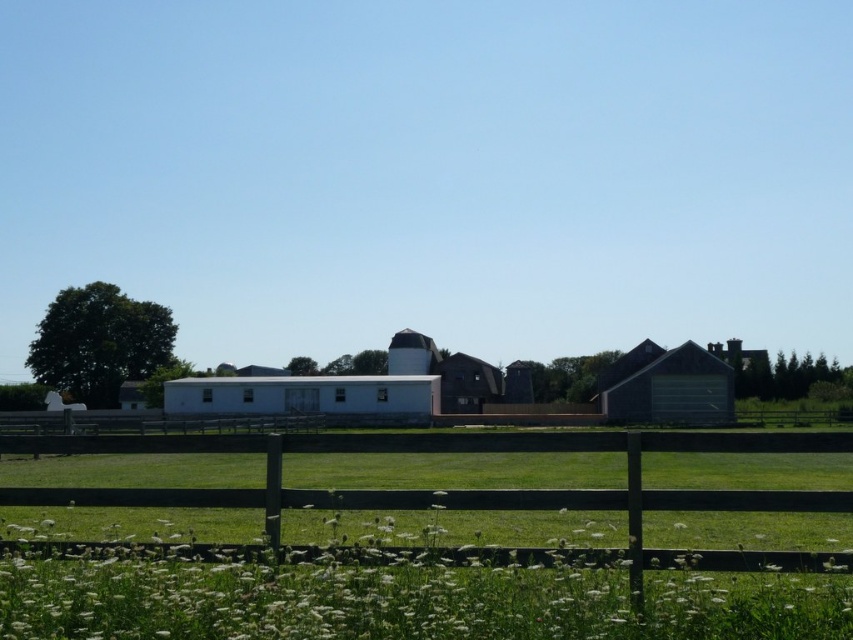
Can you confirm if white matte barn at center is smaller than green corrugated metal barn at right?

No.

Can you confirm if white matte barn at center is positioned to the right of green corrugated metal barn at right?

Incorrect, white matte barn at center is not on the right side of green corrugated metal barn at right.

Locate an element on the screen. The height and width of the screenshot is (640, 853). white matte barn at center is located at coordinates (305, 396).